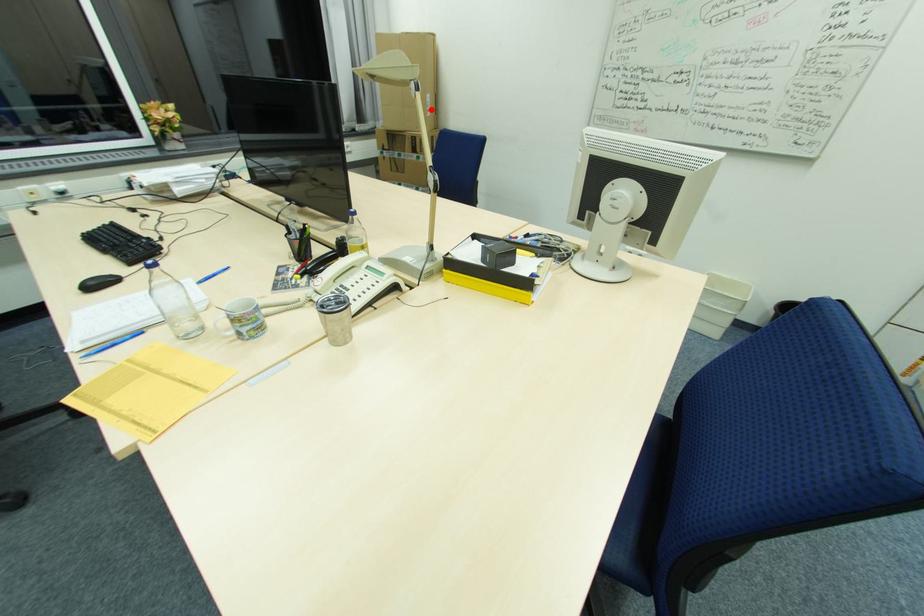
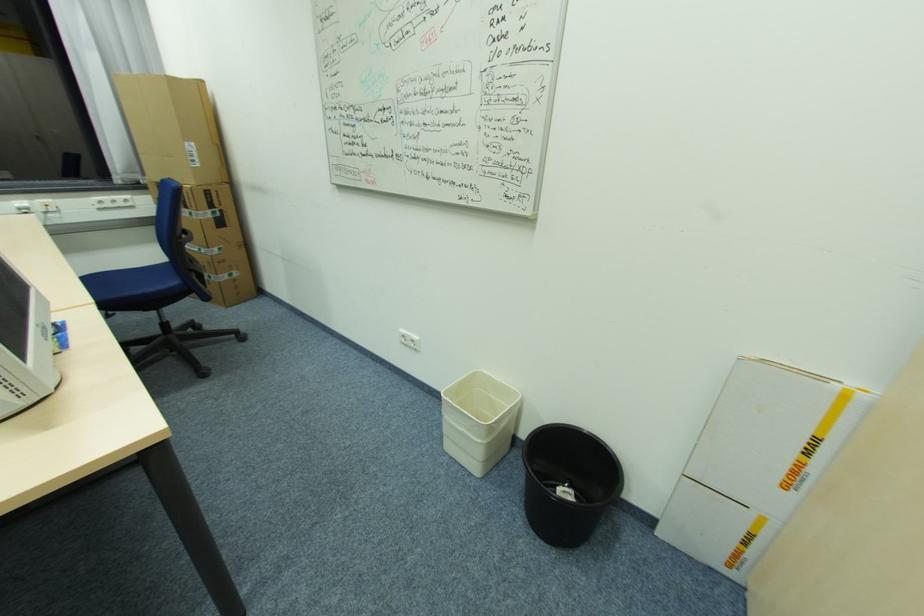
Question: I am providing you with two images of the same scene from different viewpoints. A red point is marked on the first image. Is the red point's position out of view in image 2?

Choices:
 (A) Yes
 (B) No

Answer: (B)